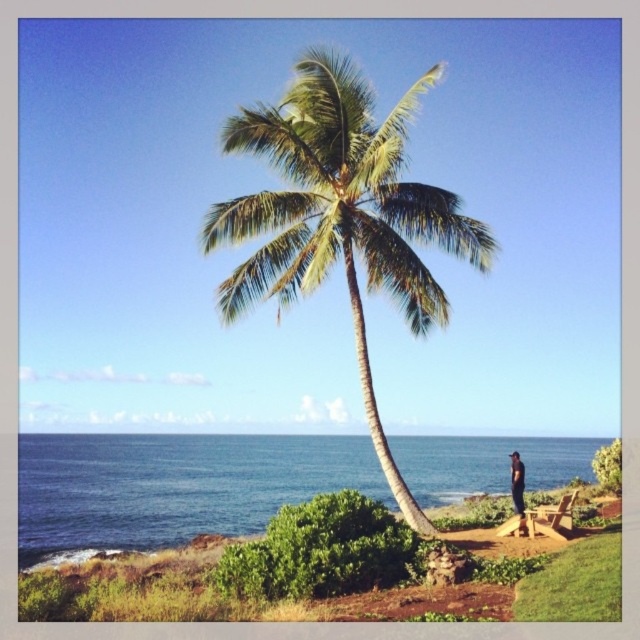
You are a painter setting up your easel to capture the coastal scene. You want to ensure that the green leafy coconut tree at center and the blue water at lower left are both visible in your painting. Based on their sizes, which object should you focus on placing first to ensure proper composition?

The green leafy coconut tree at center is narrower than the blue water at lower left, so you should focus on placing the blue water at lower left first as it occupies more space in the scene.

You are a photographer trying to capture the green leafy coconut tree at center and the dark blue jeans at lower right in the same frame. Based on their positions, which object would appear larger in the photo?

The green leafy coconut tree at center would appear larger in the photo because it is located above the dark blue jeans at lower right, meaning it is closer to the camera.